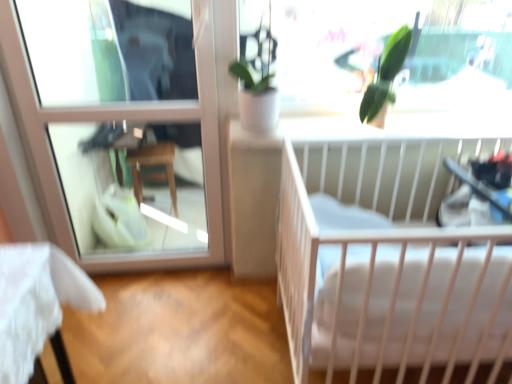
Question: Does white matte crib at right contain black plastic baby carriage at right?

Choices:
 (A) yes
 (B) no

Answer: (A)

Question: Can you confirm if white matte crib at right is taller than black plastic baby carriage at right?

Choices:
 (A) no
 (B) yes

Answer: (B)

Question: From a real-world perspective, is white matte crib at right beneath black plastic baby carriage at right?

Choices:
 (A) yes
 (B) no

Answer: (A)

Question: Considering the relative positions of white matte crib at right and black plastic baby carriage at right in the image provided, is white matte crib at right in front of black plastic baby carriage at right?

Choices:
 (A) yes
 (B) no

Answer: (A)

Question: Can we say white matte crib at right lies outside black plastic baby carriage at right?

Choices:
 (A) no
 (B) yes

Answer: (B)

Question: Can you confirm if white matte crib at right is wider than black plastic baby carriage at right?

Choices:
 (A) no
 (B) yes

Answer: (B)

Question: Are black plastic baby carriage at right and green leafy plant at upper center located far from each other?

Choices:
 (A) no
 (B) yes

Answer: (A)

Question: Is the position of black plastic baby carriage at right more distant than that of green leafy plant at upper center?

Choices:
 (A) yes
 (B) no

Answer: (B)

Question: From a real-world perspective, is black plastic baby carriage at right positioned over green leafy plant at upper center based on gravity?

Choices:
 (A) yes
 (B) no

Answer: (B)

Question: Is black plastic baby carriage at right aimed at green leafy plant at upper center?

Choices:
 (A) no
 (B) yes

Answer: (A)

Question: Does black plastic baby carriage at right have a larger size compared to green leafy plant at upper center?

Choices:
 (A) no
 (B) yes

Answer: (B)

Question: Is black plastic baby carriage at right taller than green leafy plant at upper center?

Choices:
 (A) yes
 (B) no

Answer: (B)

Question: From the image's perspective, does white soft mattress at center appear higher than clear glass window at upper left?

Choices:
 (A) no
 (B) yes

Answer: (A)